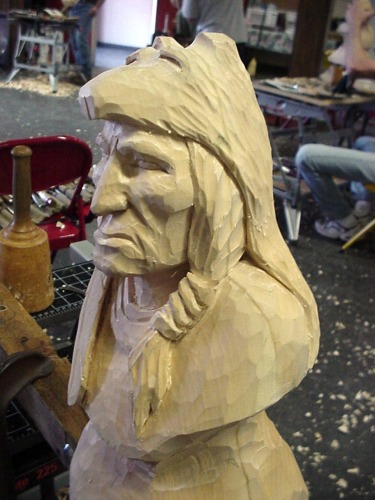
At what (x,y) coordinates should I click in order to perform the action: click on workshop table. Please return your answer as a coordinate pair (x, y). Looking at the image, I should click on (313, 104).